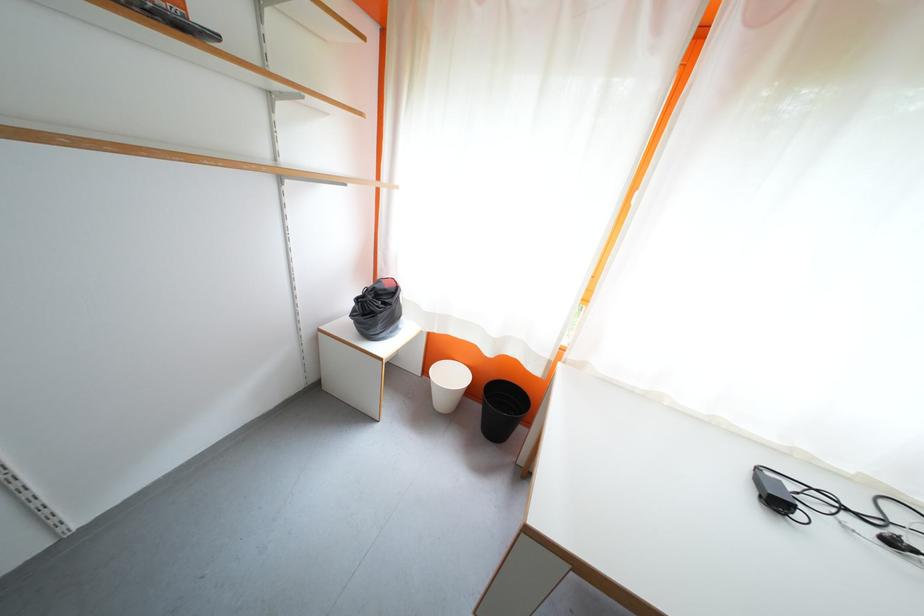
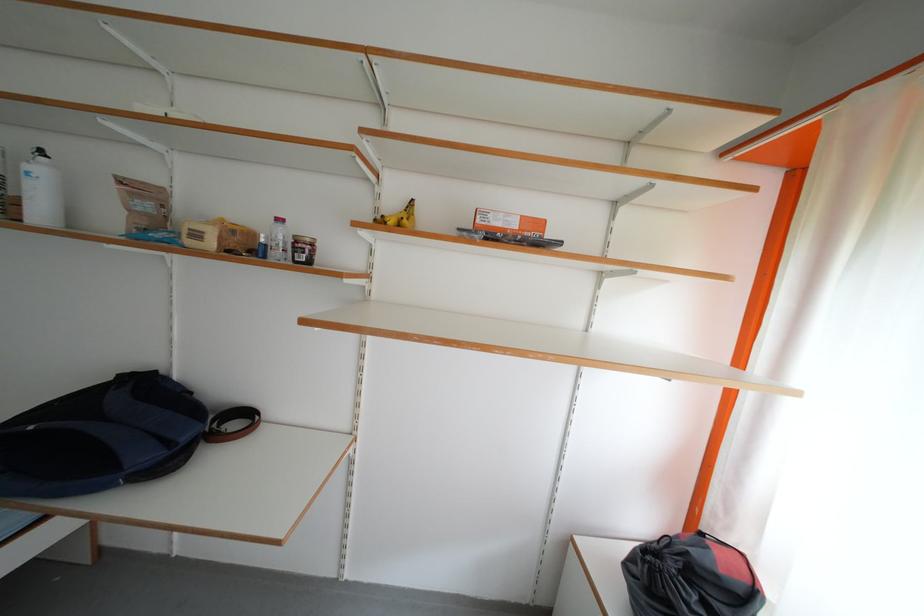
Question: The camera is either moving clockwise (left) or counter-clockwise (right) around the object. The first image is from the beginning of the video and the second image is from the end. Is the camera moving left or right when shooting the video?

Choices:
 (A) Left
 (B) Right

Answer: (B)